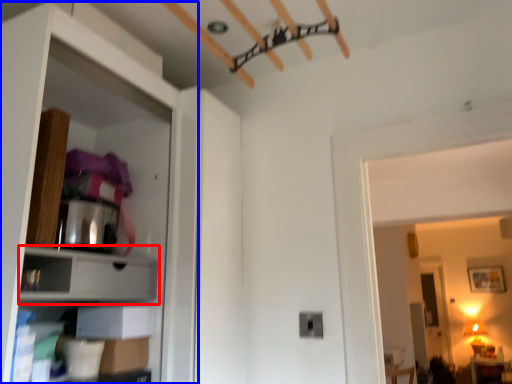
Question: Which point is further to the camera, cabinet (highlighted by a red box) or dresser (highlighted by a blue box)?

Choices:
 (A) cabinet
 (B) dresser

Answer: (A)